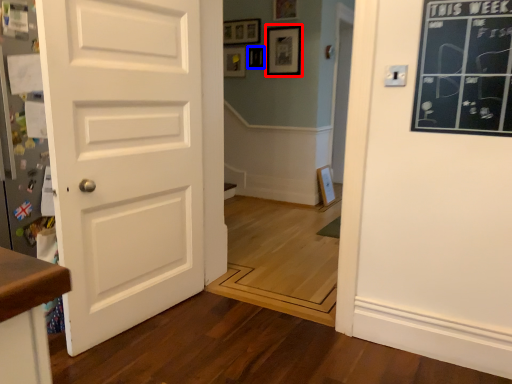
Question: Among these objects, which one is nearest to the camera, picture frame (highlighted by a red box) or picture frame (highlighted by a blue box)?

Choices:
 (A) picture frame
 (B) picture frame

Answer: (A)